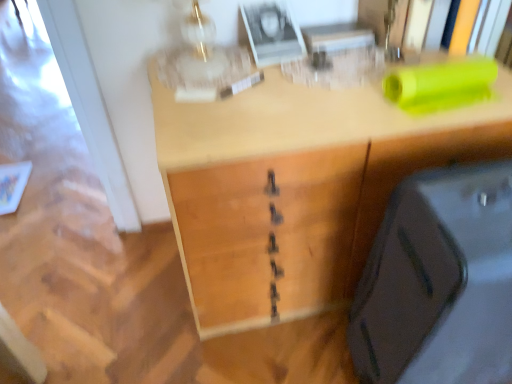
Question: Considering their positions, is wooden desk at center located in front of or behind matte black suitcase at lower right?

Choices:
 (A) behind
 (B) front

Answer: (A)

Question: Does point (316, 119) appear closer or farther from the camera than point (367, 332)?

Choices:
 (A) farther
 (B) closer

Answer: (B)

Question: Based on their sizes in the image, would you say wooden desk at center is bigger or smaller than matte black suitcase at lower right?

Choices:
 (A) small
 (B) big

Answer: (B)

Question: Is matte black suitcase at lower right bigger or smaller than wooden desk at center?

Choices:
 (A) big
 (B) small

Answer: (B)

Question: Relative to wooden desk at center, is matte black suitcase at lower right in front or behind?

Choices:
 (A) behind
 (B) front

Answer: (B)

Question: Considering the positions of matte black suitcase at lower right and wooden desk at center in the image, is matte black suitcase at lower right taller or shorter than wooden desk at center?

Choices:
 (A) short
 (B) tall

Answer: (B)

Question: From the image's perspective, is matte black suitcase at lower right positioned above or below wooden desk at center?

Choices:
 (A) above
 (B) below

Answer: (B)